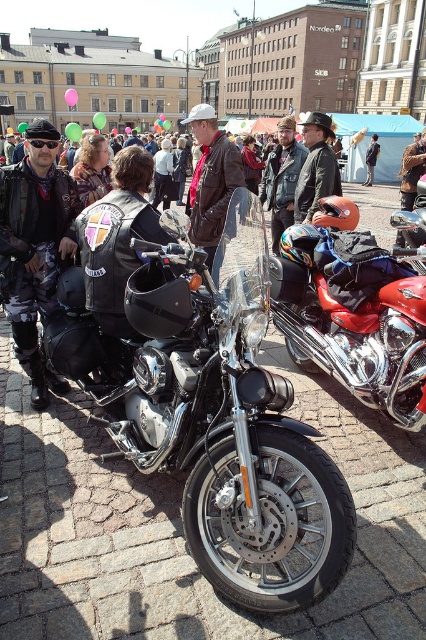
You are a biker trying to park your motorcycle between two parked cars on a narrow street. The space between the cars is exactly the width of the leather jacket at center. Can your shiny chrome motorcycle at center fit into this space?

The shiny chrome motorcycle at center might be wider than the leather jacket at center, so it may not fit into the space between the cars.

From the picture: You are a photographer trying to capture the shiny chrome motorcycle at center. Given that your camera frame is centered at coordinates point A, which is at the center of the image, will you need to adjust the camera position to include the motorcycle within the frame?

The shiny chrome motorcycle at center is located at point A, so the camera frame is already centered on it. No adjustment is needed.

You are a photographer at the motorcycle event. You want to take a photo of the polished chrome motorcycle at center and the leather jacket at center. From the photographer perspective, which object should be positioned to the left in the frame?

The polished chrome motorcycle at center should be positioned to the left of the leather jacket at center in the frame.